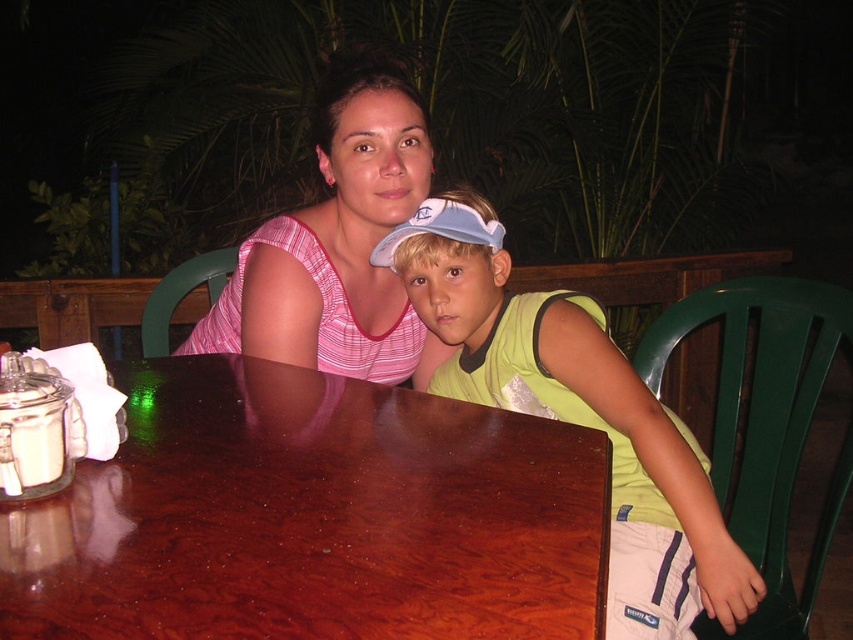
From the picture: Who is more forward, (260, 612) or (265, 314)?

Point (260, 612)

Between mahogany wood table at center and pink striped tank top at center, which one appears on the left side from the viewer's perspective?

From the viewer's perspective, pink striped tank top at center appears more on the left side.

Between point (558, 579) and point (325, 339), which one is positioned in front?

Point (558, 579)

You are a GUI agent. You are given a task and a screenshot of the screen. Output one action in this format:
    pyautogui.click(x=<x>, y=<y>)
    Task: Click on the mahogany wood table at center
    
    Given the screenshot: What is the action you would take?
    pyautogui.click(x=312, y=516)

Between mahogany wood table at center and light blue fabric baseball cap at center, which one has less height?

With less height is light blue fabric baseball cap at center.

Locate an element on the screen. Image resolution: width=853 pixels, height=640 pixels. mahogany wood table at center is located at coordinates (312, 516).

Does point (469, 356) lie behind point (328, 330)?

No, (469, 356) is closer to viewer.

Which is above, green fabric shirt at center or pink striped tank top at center?

pink striped tank top at center is above.

Is point (694, 513) more distant than point (424, 131)?

That is False.

This screenshot has height=640, width=853. What are the coordinates of `green fabric shirt at center` in the screenshot? It's located at (577, 413).